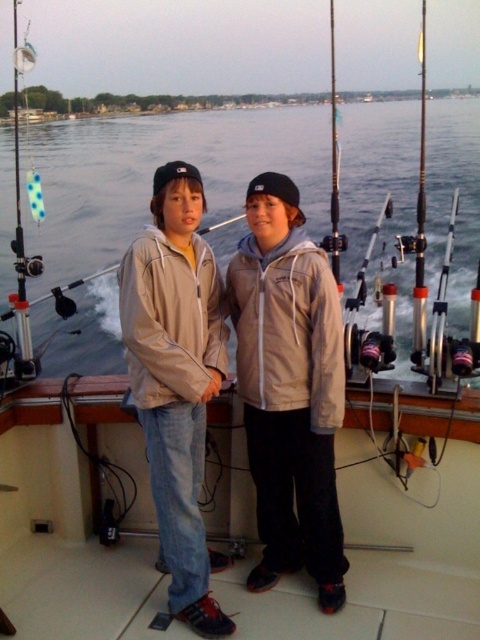
Question: Is light beige jacket at center positioned at the back of metallic fishing pole at center?

Choices:
 (A) yes
 (B) no

Answer: (B)

Question: Which of the following is the farthest from the observer?

Choices:
 (A) metallic fishing pole at center
 (B) clear water at center
 (C) clear plastic fishing pole at upper right
 (D) light beige jacket at center

Answer: (B)

Question: Which object is the farthest from the clear water at center?

Choices:
 (A) metallic fishing pole at center
 (B) clear plastic fishing pole at upper right
 (C) light beige jacket at center

Answer: (C)

Question: Does light beige jacket at center appear on the right side of clear plastic fishing pole at upper right?

Choices:
 (A) no
 (B) yes

Answer: (A)

Question: Which of the following is the farthest from the observer?

Choices:
 (A) (187, 461)
 (B) (424, 212)

Answer: (B)

Question: Does clear water at center lie behind metallic fishing pole at center?

Choices:
 (A) yes
 (B) no

Answer: (A)